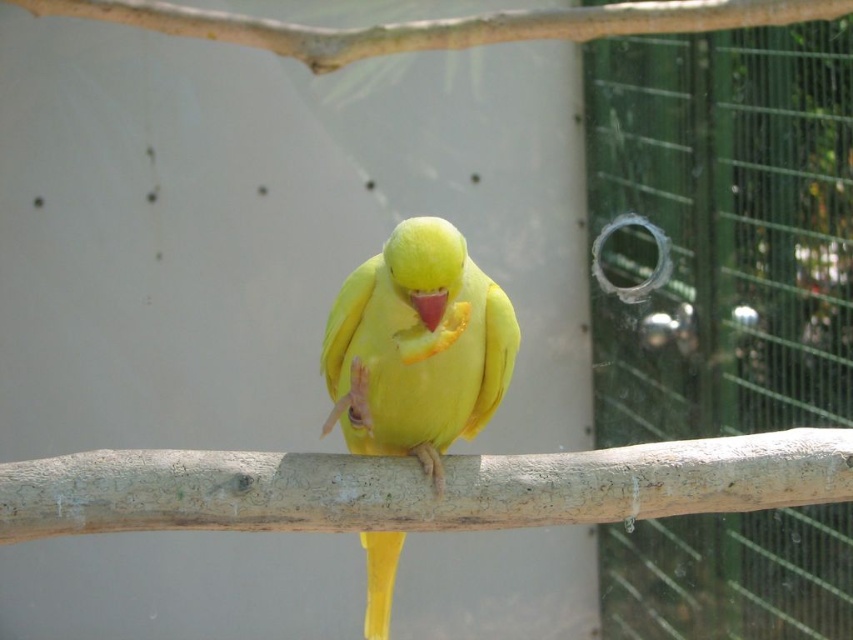
This screenshot has height=640, width=853. What do you see at coordinates (416, 348) in the screenshot? I see `yellow matte parrot at center` at bounding box center [416, 348].

Between yellow matte parrot at center and smooth wood branch at upper center, which one has less height?

smooth wood branch at upper center is shorter.

Is point (515, 326) closer to viewer compared to point (405, 40)?

Yes, point (515, 326) is in front of point (405, 40).

Identify the location of yellow matte parrot at center. Image resolution: width=853 pixels, height=640 pixels. (416, 348).

Does point (550, 467) come closer to viewer compared to point (192, 29)?

Yes.

Between point (112, 452) and point (358, 45), which one is positioned in front?

Point (112, 452) is in front.

Locate an element on the screen. This screenshot has height=640, width=853. smooth wood branch at center is located at coordinates (416, 486).

What do you see at coordinates (416, 486) in the screenshot?
I see `smooth wood branch at center` at bounding box center [416, 486].

Identify the location of smooth wood branch at center. The width and height of the screenshot is (853, 640). (416, 486).